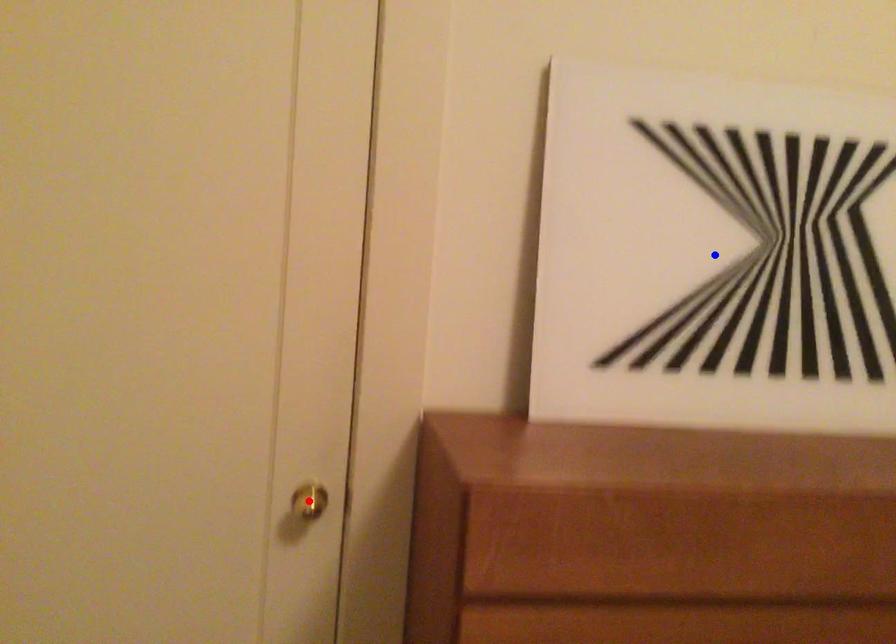
Question: Which of the two points in the image is closer to the camera?

Choices:
 (A) Blue point is closer.
 (B) Red point is closer.

Answer: (A)